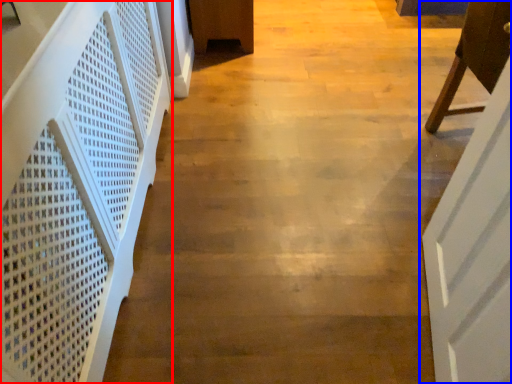
Question: Which object appears farthest to the camera in this image, stairwell (highlighted by a red box) or door (highlighted by a blue box)?

Choices:
 (A) stairwell
 (B) door

Answer: (B)